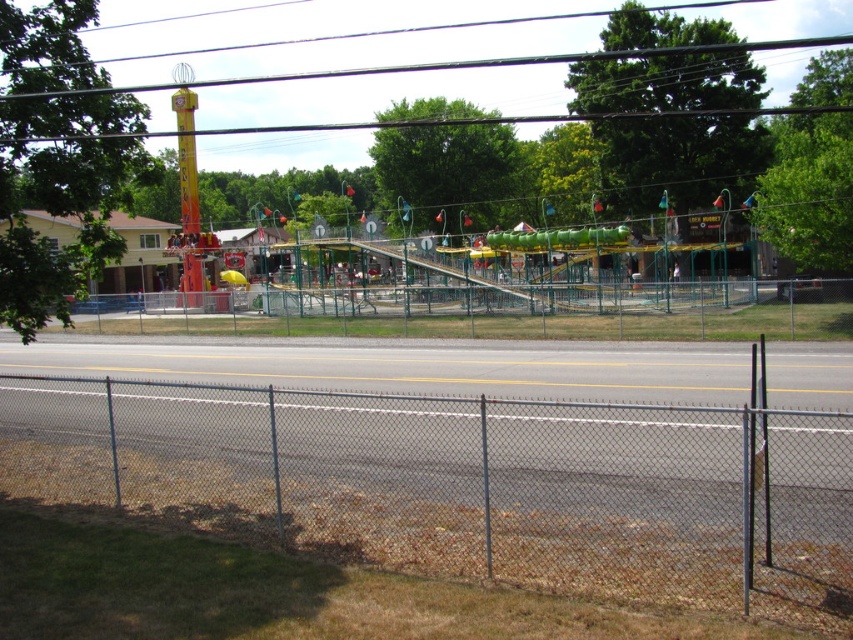
Does gray chain-link fence at lower center have a greater height compared to green metallic slide at center?

In fact, gray chain-link fence at lower center may be shorter than green metallic slide at center.

Is point (440, 481) positioned before point (373, 248)?

Yes, it is.

Identify the location of gray chain-link fence at lower center. The height and width of the screenshot is (640, 853). (466, 483).